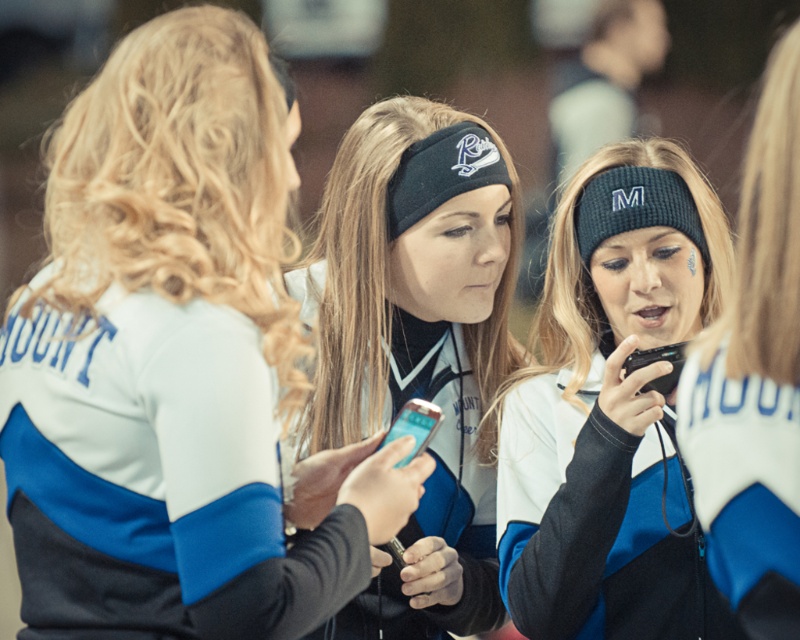
Question: Which point is farther from the camera taking this photo?

Choices:
 (A) (405, 456)
 (B) (705, 412)
 (C) (648, 317)

Answer: (C)

Question: Can you confirm if blue jersey at center is positioned to the left of black plastic phone at center?

Choices:
 (A) yes
 (B) no

Answer: (A)

Question: Can you confirm if metallic silver phone at center is positioned above black plastic phone at center?

Choices:
 (A) no
 (B) yes

Answer: (A)

Question: Based on their relative distances, which object is farther from the black plastic phone at center?

Choices:
 (A) metallic silver phone at center
 (B) black knit beanie at center

Answer: (A)

Question: Can you confirm if matte black headband at center is positioned below black plastic phone at center?

Choices:
 (A) yes
 (B) no

Answer: (A)

Question: Which of the following is the closest to the observer?

Choices:
 (A) black plastic phone at center
 (B) metallic silver phone at center
 (C) blue jersey at center
 (D) black knit beanie at center

Answer: (C)